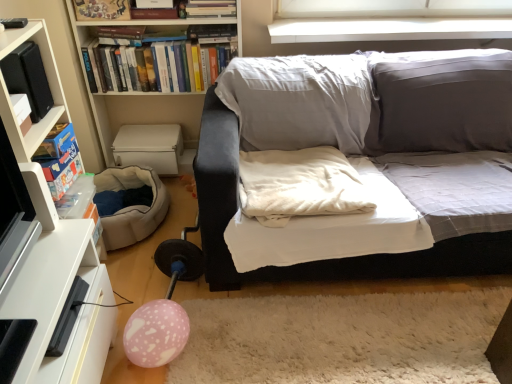
Question: From the image's perspective, would you say white fabric couch at center is positioned over white fluffy rug at lower center?

Choices:
 (A) yes
 (B) no

Answer: (A)

Question: Does white fabric couch at center come behind white fluffy rug at lower center?

Choices:
 (A) yes
 (B) no

Answer: (B)

Question: Considering the relative sizes of white fabric couch at center and white fluffy rug at lower center in the image provided, is white fabric couch at center shorter than white fluffy rug at lower center?

Choices:
 (A) no
 (B) yes

Answer: (A)

Question: Does white fabric couch at center turn towards white fluffy rug at lower center?

Choices:
 (A) no
 (B) yes

Answer: (B)

Question: Is white fabric couch at center wider than white fluffy rug at lower center?

Choices:
 (A) no
 (B) yes

Answer: (B)

Question: Is white fabric couch at center at the right side of white fluffy rug at lower center?

Choices:
 (A) no
 (B) yes

Answer: (B)

Question: Can you confirm if white fabric couch at center is shorter than white glossy tv stand at lower left?

Choices:
 (A) no
 (B) yes

Answer: (A)

Question: Can you confirm if white fabric couch at center is positioned to the right of white glossy tv stand at lower left?

Choices:
 (A) yes
 (B) no

Answer: (A)

Question: From the image's perspective, is white fabric couch at center below white glossy tv stand at lower left?

Choices:
 (A) yes
 (B) no

Answer: (B)

Question: Is white fabric couch at center positioned with its back to white glossy tv stand at lower left?

Choices:
 (A) no
 (B) yes

Answer: (A)

Question: Is white fabric couch at center next to white glossy tv stand at lower left and touching it?

Choices:
 (A) no
 (B) yes

Answer: (A)

Question: From the image's perspective, is white fabric couch at center over white glossy tv stand at lower left?

Choices:
 (A) no
 (B) yes

Answer: (B)

Question: Is white fabric couch at center shorter than matte wooden frame at upper left, which is the 2th book from back to front?

Choices:
 (A) no
 (B) yes

Answer: (A)